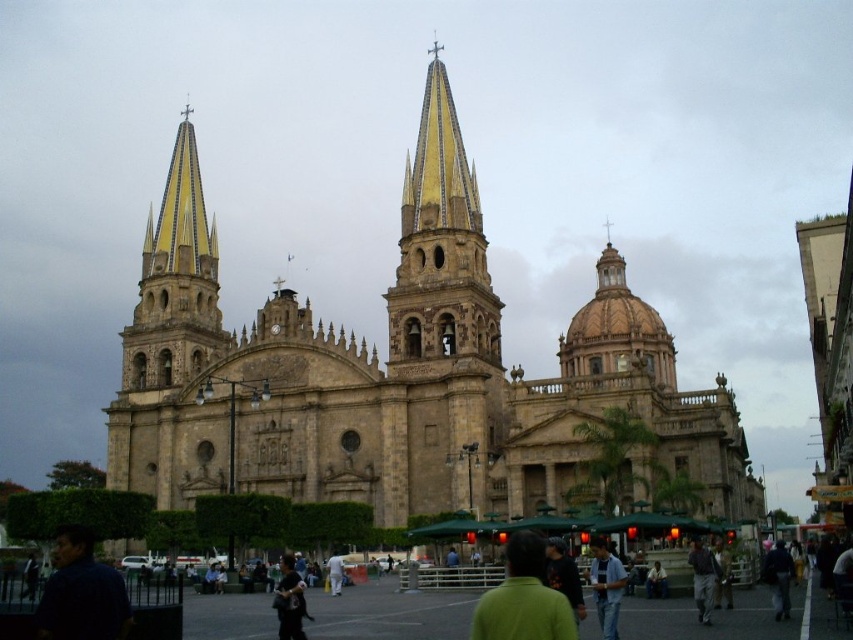
Can you confirm if green matte shirt at lower center is smaller than white fabric bag at center?

Actually, green matte shirt at lower center might be larger than white fabric bag at center.

Can you confirm if green matte shirt at lower center is wider than white fabric bag at center?

Yes, green matte shirt at lower center is wider than white fabric bag at center.

Who is more forward, (492, 637) or (334, 557)?

Point (492, 637)

Locate an element on the screen. green matte shirt at lower center is located at coordinates (523, 598).

Is the position of beige stone church at center less distant than that of dark blue shirt at lower left?

No, beige stone church at center is further to the viewer.

Is point (260, 392) farther from camera compared to point (74, 595)?

That is True.

Between point (724, 408) and point (82, 625), which one is positioned in front?

Point (82, 625) is more forward.

Find the location of a particular element. beige stone church at center is located at coordinates (399, 374).

Who is higher up, dark blue jacket at center or dark gray fabric jacket at lower right?

Positioned higher is dark blue jacket at center.

Is the position of dark blue jacket at center more distant than that of dark gray fabric jacket at lower right?

No, it is not.

Who is more forward, (763, 568) or (659, 579)?

Point (659, 579) is in front.

Find the location of a particular element. dark blue jacket at center is located at coordinates (778, 577).